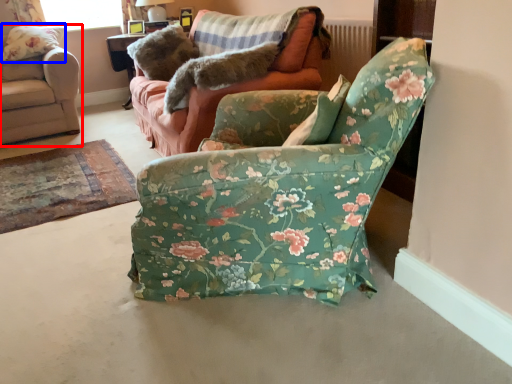
Question: Which object is closer to the camera taking this photo, chair (highlighted by a red box) or pillow (highlighted by a blue box)?

Choices:
 (A) chair
 (B) pillow

Answer: (A)